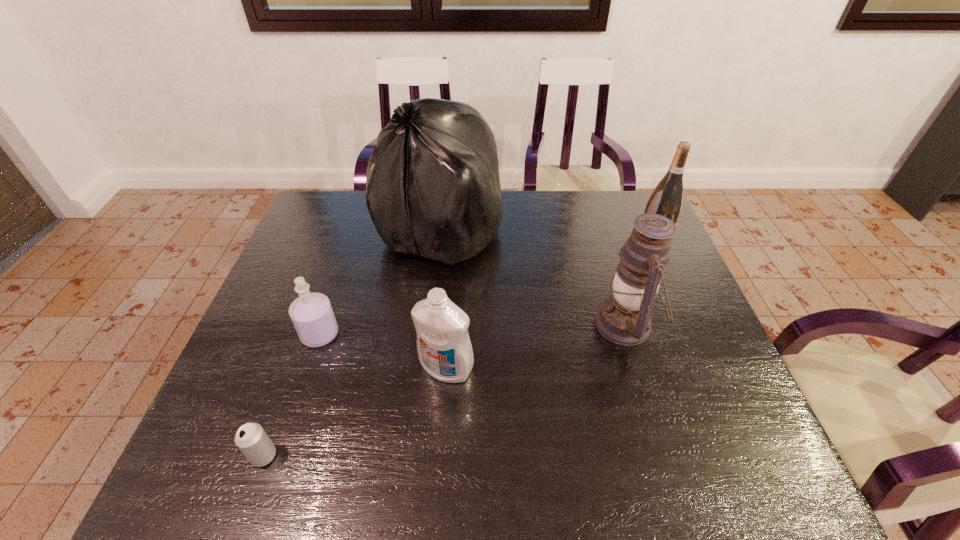
This screenshot has width=960, height=540. I want to click on vacant space located on the label of the wine bottle, so click(x=546, y=244).

At what (x,y) coordinates should I click in order to perform the action: click on free space located 0.230m on the back of the oil lamp. Please return your answer as a coordinate pair (x, y). The width and height of the screenshot is (960, 540). Looking at the image, I should click on (600, 240).

Locate an element on the screen. The image size is (960, 540). vacant area situated on the back of the fourth tallest object is located at coordinates (449, 326).

This screenshot has height=540, width=960. Find the location of `free space located on the front of the fifth tallest object`. free space located on the front of the fifth tallest object is located at coordinates (287, 433).

Find the location of a particular element. free space located 0.170m on the right of the shortest object is located at coordinates (363, 456).

In order to click on plastic bag that is positioned at the far edge in this screenshot , I will do `click(434, 190)`.

At what (x,y) coordinates should I click in order to perform the action: click on wine bottle positioned at the far edge. Please return your answer as a coordinate pair (x, y). Looking at the image, I should click on (667, 198).

I want to click on object present at the near edge, so click(x=252, y=440).

Where is `perfume located in the left edge section of the desktop`? This screenshot has height=540, width=960. perfume located in the left edge section of the desktop is located at coordinates (311, 313).

Locate an element on the screen. beer can present at the left edge is located at coordinates (252, 440).